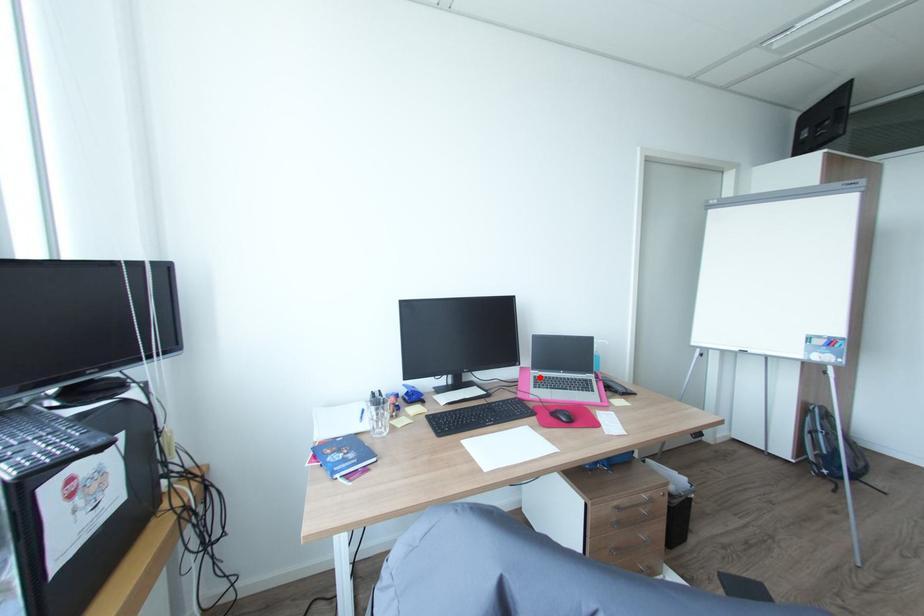
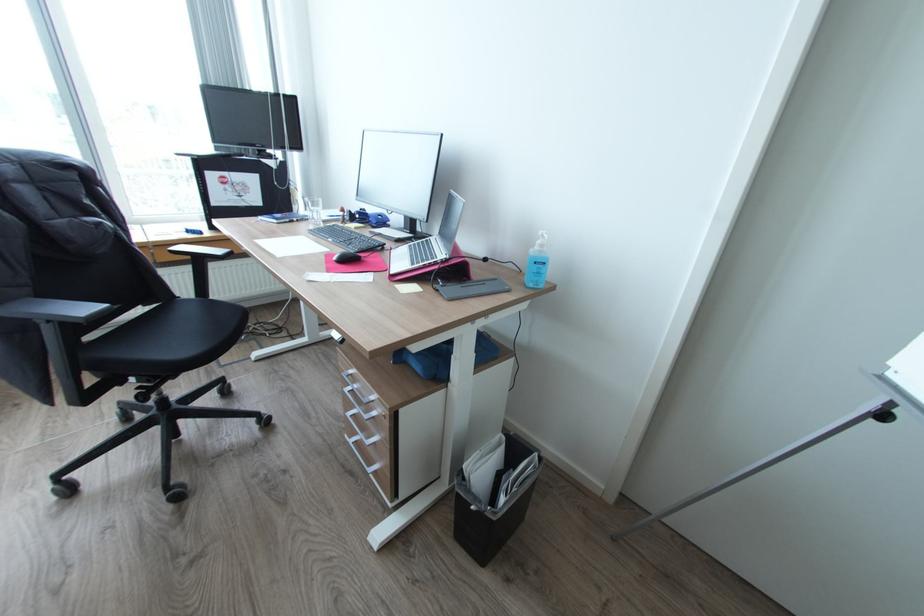
In the second image, find the point that corresponds to the highlighted location in the first image.

(432, 238)